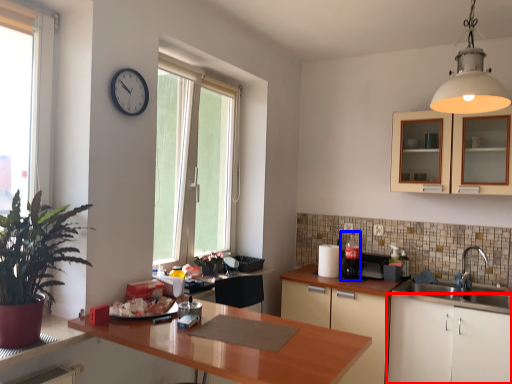
Question: Which object is closer to the camera taking this photo, cabinetry (highlighted by a red box) or appliance (highlighted by a blue box)?

Choices:
 (A) cabinetry
 (B) appliance

Answer: (A)